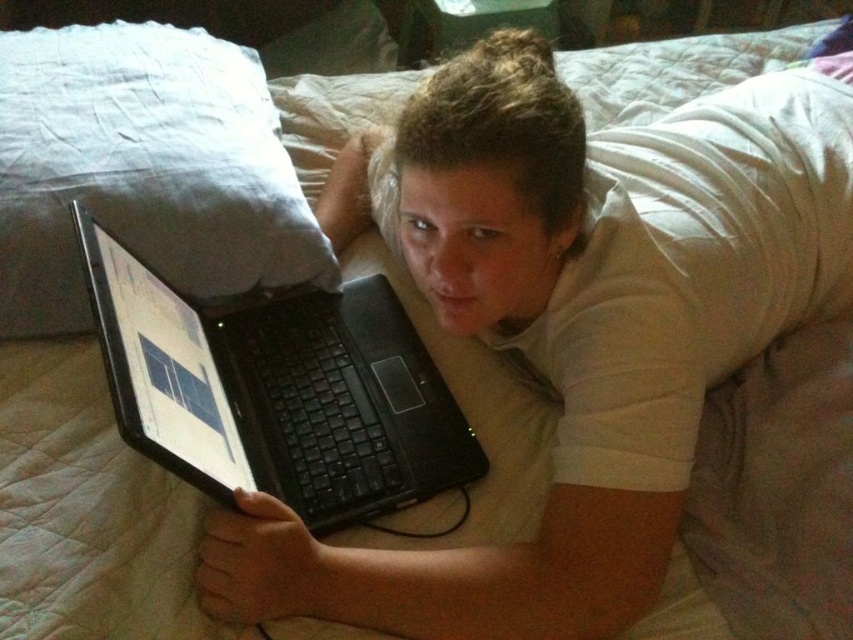
You are trying to place a new book on the bed between the white soft pillow at upper left and the black matte laptop at center. Based on the scene, can you determine if there is enough space between them to fit the book?

The white soft pillow at upper left is to the left of the black matte laptop at center, so there is space between them to place the book.

From the picture: You are a delivery robot entering a bedroom and need to place a small package on the nearest available surface. You see the white soft pillow at upper left and the black matte laptop at center. Which surface should you choose?

The white soft pillow at upper left is further to the viewer than the black matte laptop at center, so the black matte laptop at center is closer to you. However, placing a package on the laptop might disturb the person using it. The pillow is a more suitable surface, but since it is further away, you should check if there are other closer surfaces available. If not, the pillow is the nearest option but may not be ideal due to its softness.